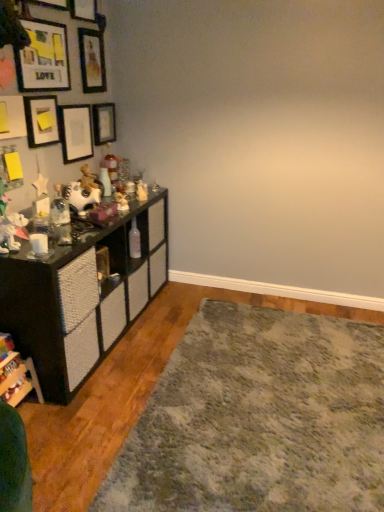
Question: From a real-world perspective, is matte black picture frame at upper left, marked as the 2th picture frame in a bottom-to-top arrangement, physically above wooden picture frame at upper left, placed as the 4th picture frame when sorted from bottom to top?

Choices:
 (A) no
 (B) yes

Answer: (A)

Question: Is matte black picture frame at upper left, marked as the 2th picture frame in a bottom-to-top arrangement, wider than wooden picture frame at upper left, placed as the 4th picture frame when sorted from bottom to top?

Choices:
 (A) yes
 (B) no

Answer: (B)

Question: Does matte black picture frame at upper left, marked as the 2th picture frame in a bottom-to-top arrangement, come behind wooden picture frame at upper left, positioned as the 3th picture frame in top-to-bottom order?

Choices:
 (A) no
 (B) yes

Answer: (B)

Question: From the image's perspective, is matte black picture frame at upper left, positioned as the fifth picture frame in top-to-bottom order, beneath wooden picture frame at upper left, placed as the 4th picture frame when sorted from bottom to top?

Choices:
 (A) no
 (B) yes

Answer: (B)

Question: Can wooden picture frame at upper left, placed as the 4th picture frame when sorted from bottom to top, be found inside matte black picture frame at upper left, positioned as the fifth picture frame in top-to-bottom order?

Choices:
 (A) yes
 (B) no

Answer: (B)

Question: Would you say matte black picture frame at upper left, the second picture frame positioned from the top, is to the left or to the right of matte black picture frame at upper left, positioned as the fifth picture frame in top-to-bottom order, in the picture?

Choices:
 (A) right
 (B) left

Answer: (A)

Question: Which is correct: matte black picture frame at upper left, the second picture frame positioned from the top, is inside matte black picture frame at upper left, marked as the 2th picture frame in a bottom-to-top arrangement, or outside of it?

Choices:
 (A) inside
 (B) outside

Answer: (B)

Question: Considering the positions of matte black picture frame at upper left, the second picture frame positioned from the top, and matte black picture frame at upper left, positioned as the fifth picture frame in top-to-bottom order, in the image, is matte black picture frame at upper left, the second picture frame positioned from the top, wider or thinner than matte black picture frame at upper left, positioned as the fifth picture frame in top-to-bottom order,?

Choices:
 (A) wide
 (B) thin

Answer: (A)

Question: From the image's perspective, is matte black picture frame at upper left, the second picture frame positioned from the top, positioned above or below matte black picture frame at upper left, positioned as the fifth picture frame in top-to-bottom order?

Choices:
 (A) below
 (B) above

Answer: (B)

Question: From their relative heights in the image, would you say wooden picture frame at upper left, the 1th picture frame when ordered from top to bottom, is taller or shorter than black textured cabinet at left, the 1th shelf in the back-to-front sequence?

Choices:
 (A) tall
 (B) short

Answer: (B)

Question: Is wooden picture frame at upper left, the 1th picture frame when ordered from top to bottom, spatially inside black textured cabinet at left, acting as the second shelf starting from the front, or outside of it?

Choices:
 (A) outside
 (B) inside

Answer: (A)

Question: From the image's perspective, relative to black textured cabinet at left, the 1th shelf in the back-to-front sequence, is wooden picture frame at upper left, which is the sixth picture frame in bottom-to-top order, above or below?

Choices:
 (A) above
 (B) below

Answer: (A)

Question: Considering the positions of wooden picture frame at upper left, which is the sixth picture frame in bottom-to-top order, and black textured cabinet at left, the 1th shelf in the back-to-front sequence, in the image, is wooden picture frame at upper left, which is the sixth picture frame in bottom-to-top order, bigger or smaller than black textured cabinet at left, the 1th shelf in the back-to-front sequence,?

Choices:
 (A) small
 (B) big

Answer: (A)

Question: In terms of size, does wooden bookshelf at lower left, the 2th shelf in the back-to-front sequence, appear bigger or smaller than wooden picture frame at upper left, placed as the 4th picture frame when sorted from bottom to top?

Choices:
 (A) big
 (B) small

Answer: (B)

Question: From a real-world perspective, is wooden bookshelf at lower left, which is the first shelf in front-to-back order, positioned above or below wooden picture frame at upper left, placed as the 4th picture frame when sorted from bottom to top?

Choices:
 (A) above
 (B) below

Answer: (B)